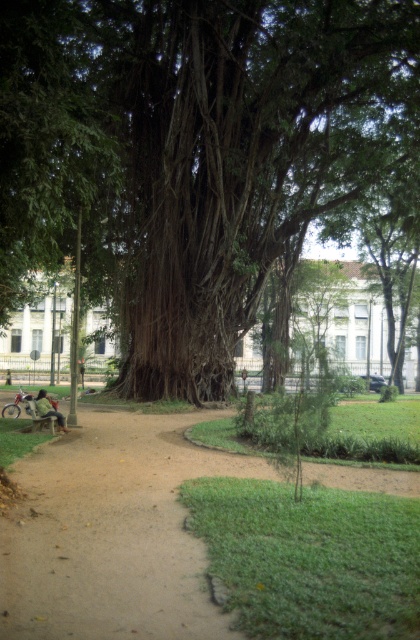
Does wooden park bench at lower left have a greater height compared to green fabric jacket at lower left?

No.

Is wooden park bench at lower left in front of green fabric jacket at lower left?

Yes.

Which is in front, point (42, 422) or point (58, 422)?

Point (42, 422)

This screenshot has height=640, width=420. I want to click on wooden park bench at lower left, so click(x=39, y=413).

Can you confirm if green leafy tree at center is positioned to the right of brown dirt path at lower left?

Indeed, green leafy tree at center is positioned on the right side of brown dirt path at lower left.

Looking at this image, which is above, green leafy tree at center or brown dirt path at lower left?

Positioned higher is green leafy tree at center.

Describe the element at coordinates (194, 152) in the screenshot. The width and height of the screenshot is (420, 640). I see `green leafy tree at center` at that location.

I want to click on green leafy tree at center, so click(194, 152).

Is green leafy tree at center above wooden park bench at lower left?

Correct, green leafy tree at center is located above wooden park bench at lower left.

Between green leafy tree at center and wooden park bench at lower left, which one is positioned lower?

Positioned lower is wooden park bench at lower left.

Who is more distant from viewer, (157, 323) or (36, 420)?

Point (157, 323)

Locate an element on the screen. The height and width of the screenshot is (640, 420). green leafy tree at center is located at coordinates (194, 152).